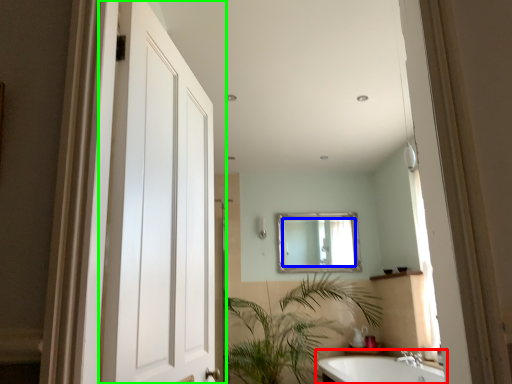
Question: Considering the real-world distances, which object is closest to bathtub (highlighted by a red box)? mirror (highlighted by a blue box) or door (highlighted by a green box).

Choices:
 (A) mirror
 (B) door

Answer: (A)